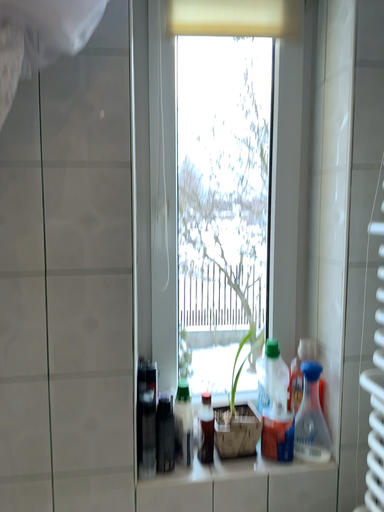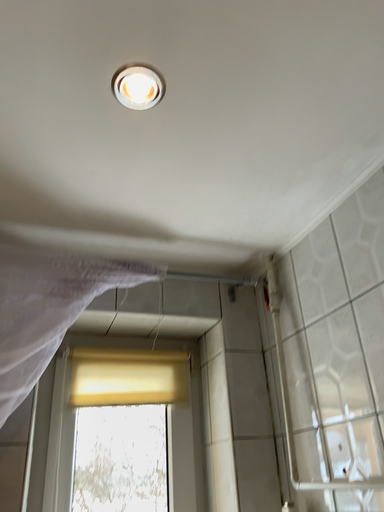
Question: How did the camera likely rotate when shooting the video?

Choices:
 (A) rotated downward
 (B) rotated upward

Answer: (B)